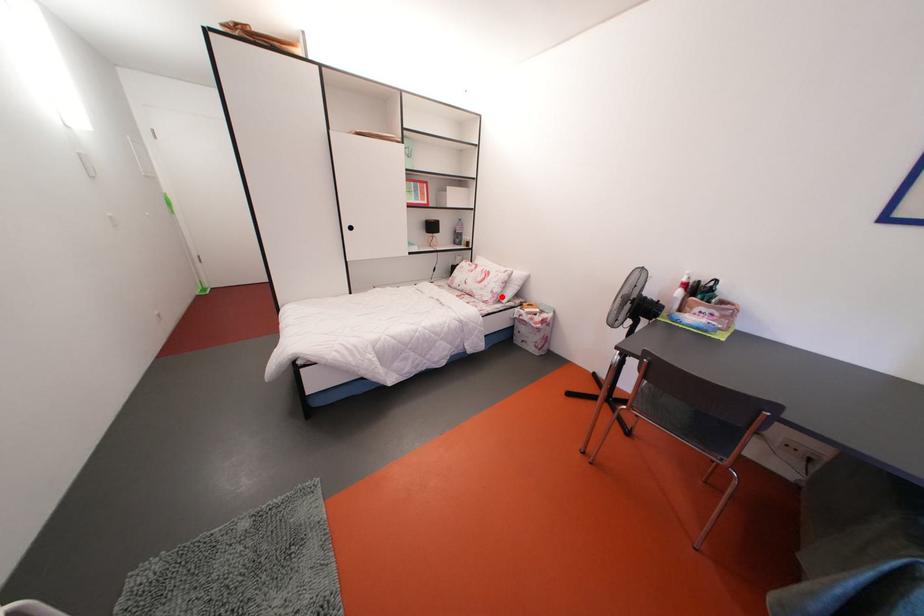
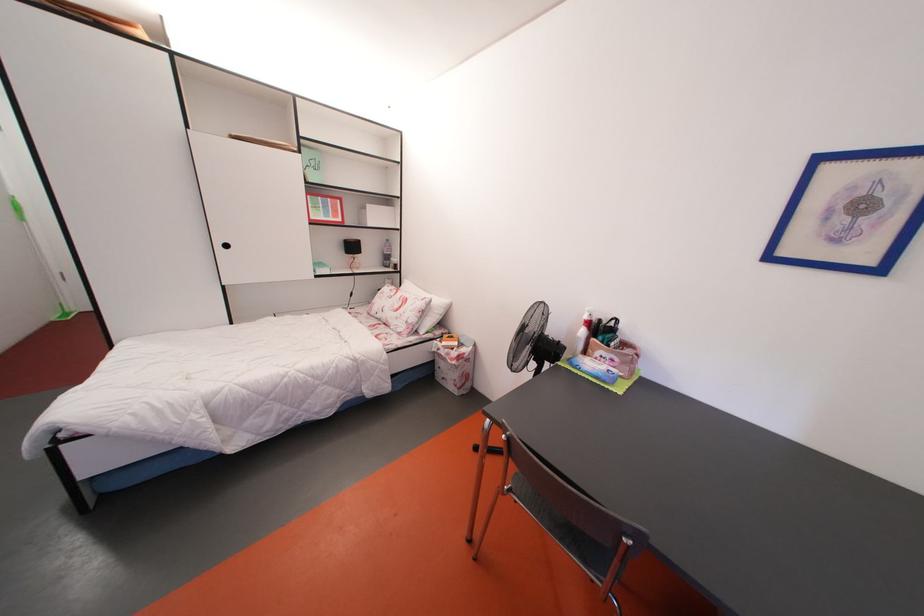
Question: I am providing you with two images of the same scene from different viewpoints. Image1 has a red point marked. In image2, the corresponding 3D location appears at what relative position? Reply with the corresponding letter.

Choices:
 (A) Closer
 (B) Farther

Answer: (B)